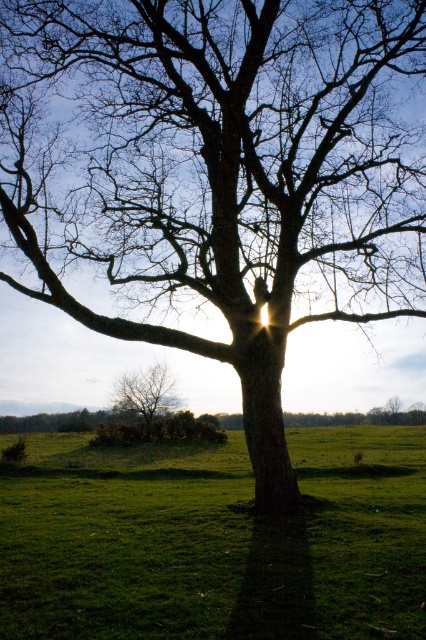
Is the position of green grass at center less distant than that of smooth bark tree at lower left?

That is True.

Is point (23, 534) closer to viewer compared to point (158, 406)?

Yes, it is.

Between point (394, 464) and point (150, 410), which one is positioned in front?

Positioned in front is point (394, 464).

Image resolution: width=426 pixels, height=640 pixels. What are the coordinates of `green grass at center` in the screenshot? It's located at (215, 541).